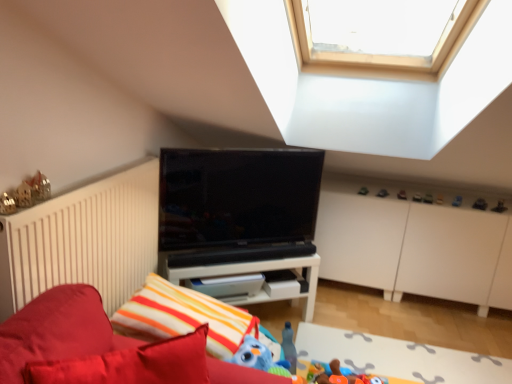
Locate an element on the screen. The image size is (512, 384). vacant space that's between matte black toy car at upper right, the 8th toy when ordered from right to left, and matte black toy car at upper center, the 9th toy in the front-to-back sequence is located at coordinates (392, 193).